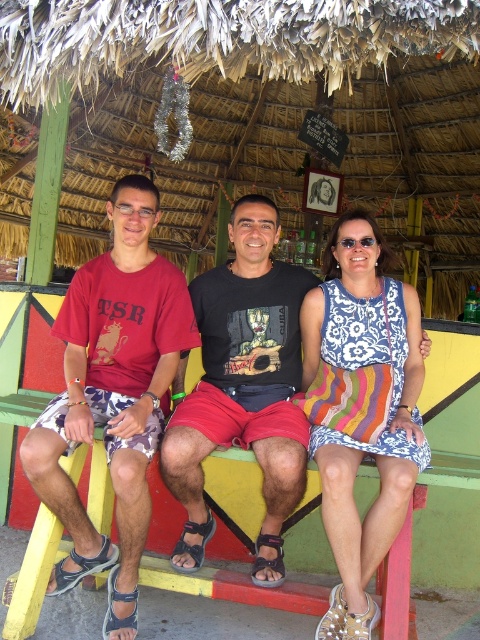
Question: Among these points, which one is nearest to the camera?

Choices:
 (A) (244, 268)
 (B) (336, 529)

Answer: (B)

Question: Which point is farther to the camera?

Choices:
 (A) black cotton t-shirt at center
 (B) matte red t-shirt at left

Answer: (A)

Question: Where is matte red t-shirt at left located in relation to floral-patterned fabric dress at center in the image?

Choices:
 (A) left
 (B) right

Answer: (A)

Question: Which point is farther to the camera?

Choices:
 (A) (169, 301)
 (B) (268, 465)

Answer: (A)

Question: From the image, what is the correct spatial relationship of matte red t-shirt at left in relation to floral-patterned fabric dress at center?

Choices:
 (A) right
 (B) left

Answer: (B)

Question: Does matte red t-shirt at left have a smaller size compared to black cotton t-shirt at center?

Choices:
 (A) no
 (B) yes

Answer: (A)